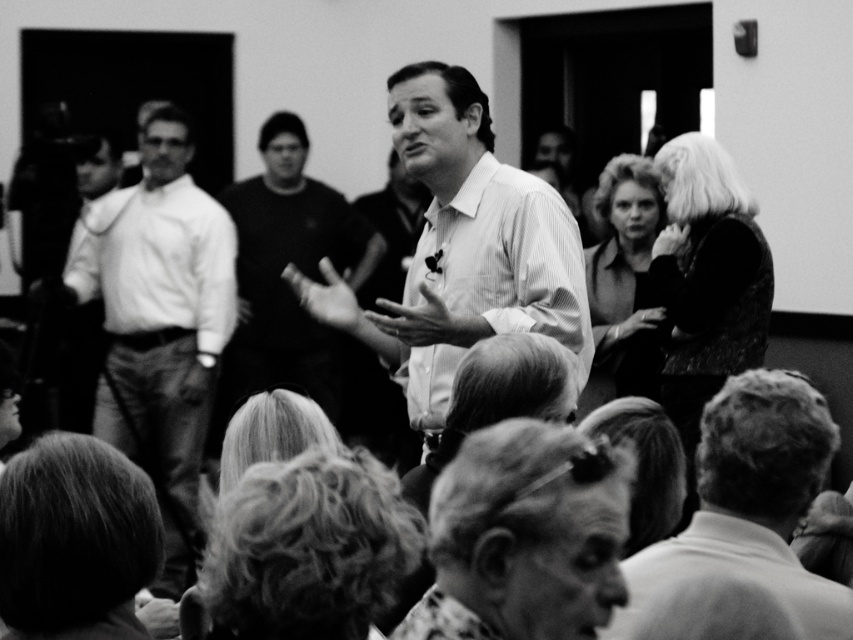
Can you confirm if smooth white shirt at lower right is smaller than velvet black dress at upper right?

Indeed, smooth white shirt at lower right has a smaller size compared to velvet black dress at upper right.

Does smooth white shirt at lower right appear over velvet black dress at upper right?

Incorrect, smooth white shirt at lower right is not positioned above velvet black dress at upper right.

Which is behind, point (798, 500) or point (648, 269)?

The point (648, 269) is behind.

Identify the location of smooth white shirt at lower right. (747, 513).

Does smooth white shirt at left appear under smooth white shirt at lower right?

Actually, smooth white shirt at left is above smooth white shirt at lower right.

How distant is smooth white shirt at left from smooth white shirt at lower right?

smooth white shirt at left is 5.73 meters from smooth white shirt at lower right.

Is point (177, 132) in front of point (720, 467)?

No, (177, 132) is further to viewer.

Find the location of a particular element. smooth white shirt at left is located at coordinates (160, 324).

The image size is (853, 640). What are the coordinates of `smooth white shirt at left` in the screenshot? It's located at (160, 324).

Does point (146, 456) lie behind point (346, 220)?

No, (146, 456) is in front of (346, 220).

Which is behind, point (189, 292) or point (328, 372)?

Point (328, 372)

I want to click on smooth white shirt at left, so click(160, 324).